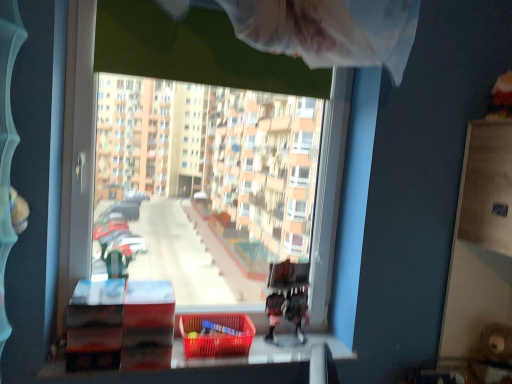
Question: Is transparent plastic window at center aimed at wooden bunk bed at center?

Choices:
 (A) yes
 (B) no

Answer: (A)

Question: Does transparent plastic window at center have a lesser width compared to wooden bunk bed at center?

Choices:
 (A) no
 (B) yes

Answer: (A)

Question: Does transparent plastic window at center have a lesser height compared to wooden bunk bed at center?

Choices:
 (A) yes
 (B) no

Answer: (B)

Question: Is transparent plastic window at center facing away from wooden bunk bed at center?

Choices:
 (A) no
 (B) yes

Answer: (B)

Question: Is transparent plastic window at center taller than wooden bunk bed at center?

Choices:
 (A) no
 (B) yes

Answer: (B)

Question: Does transparent plastic window at center appear on the right side of wooden bunk bed at center?

Choices:
 (A) yes
 (B) no

Answer: (B)

Question: Considering the relative positions of wooden bunk bed at center and translucent plastic basket at lower center in the image provided, is wooden bunk bed at center to the right of translucent plastic basket at lower center from the viewer's perspective?

Choices:
 (A) no
 (B) yes

Answer: (B)

Question: From a real-world perspective, is wooden bunk bed at center physically above translucent plastic basket at lower center?

Choices:
 (A) yes
 (B) no

Answer: (A)

Question: Would you consider wooden bunk bed at center to be distant from translucent plastic basket at lower center?

Choices:
 (A) no
 (B) yes

Answer: (A)

Question: Is wooden bunk bed at center wider than translucent plastic basket at lower center?

Choices:
 (A) no
 (B) yes

Answer: (A)

Question: Are wooden bunk bed at center and translucent plastic basket at lower center making contact?

Choices:
 (A) yes
 (B) no

Answer: (B)

Question: Does wooden bunk bed at center have a lesser width compared to translucent plastic basket at lower center?

Choices:
 (A) yes
 (B) no

Answer: (A)

Question: Is wooden bunk bed at center oriented away from transparent plastic window at center?

Choices:
 (A) yes
 (B) no

Answer: (A)